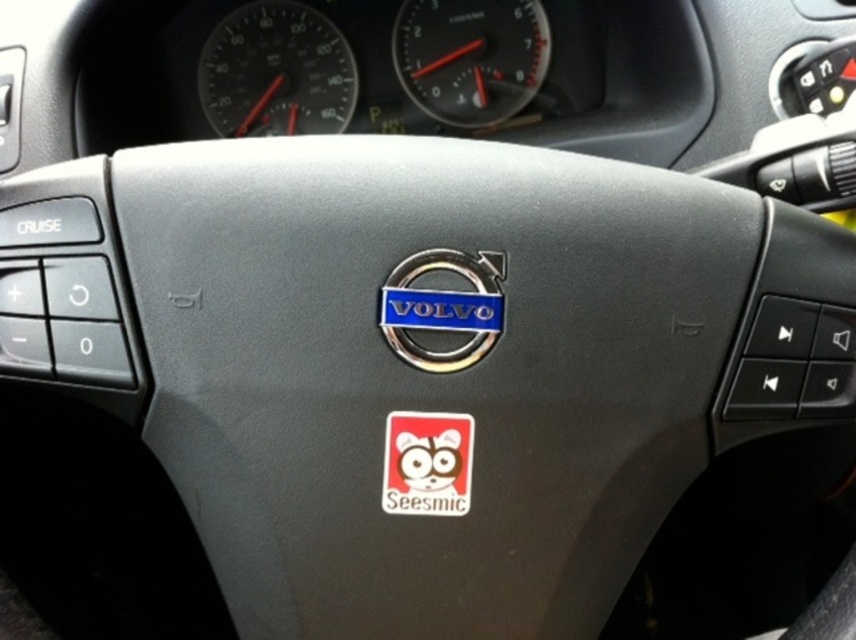
You are a car mechanic inspecting the dashboard of a Volvo. You notice the metallic silver speedometer at upper center and the red matte sticker at center. Which object has a greater width?

The metallic silver speedometer at upper center has a greater width than the red matte sticker at center.

Consider the image. You are a driver checking your vehicle instruments. You see the matte black speedometer at upper center and the metallic silver speedometer at upper center. Which one shows your current speed?

The matte black speedometer at upper center shows the current speed because it is larger in size than the metallic silver speedometer at upper center, which is likely the RPM gauge.

You are a driver sitting in the Volvo vehicle shown. You notice a point at coordinates (276, 72) on the dashboard. What object is located at that point?

The point at coordinates (276, 72) corresponds to the matte black speedometer at upper center.